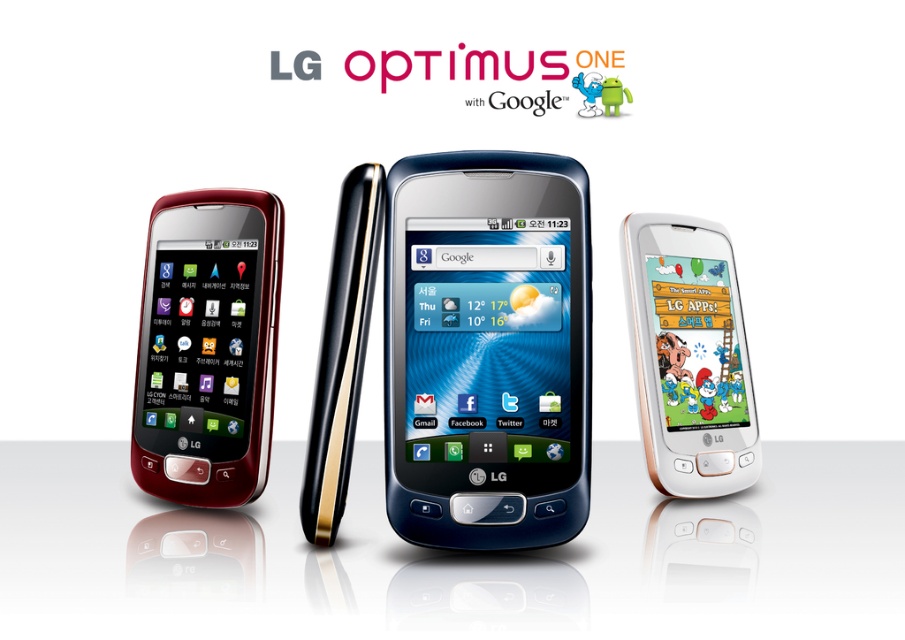
Question: Which of the following is the farthest from the observer?

Choices:
 (A) metallic blue phone at center
 (B) matte black phone at left
 (C) matte black phone at center
 (D) white glossy smartphone at center

Answer: (D)

Question: Does metallic blue phone at center appear under matte black phone at left?

Choices:
 (A) no
 (B) yes

Answer: (A)

Question: Which of the following is the closest to the observer?

Choices:
 (A) (682, 348)
 (B) (187, 284)
 (C) (392, 328)

Answer: (C)

Question: Which point appears closest to the camera in this image?

Choices:
 (A) (886, 474)
 (B) (399, 205)

Answer: (B)

Question: Is matte black phone at center positioned behind metallic blue phone at center?

Choices:
 (A) no
 (B) yes

Answer: (A)

Question: Does metallic blue phone at center appear over matte black phone at left?

Choices:
 (A) no
 (B) yes

Answer: (B)